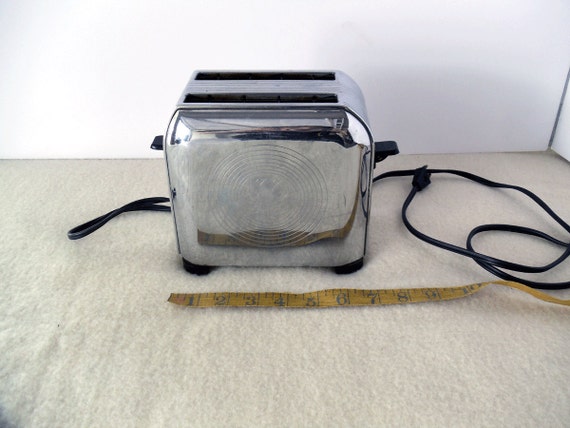
This screenshot has width=570, height=428. In order to click on toaster in this screenshot , I will do `click(266, 166)`.